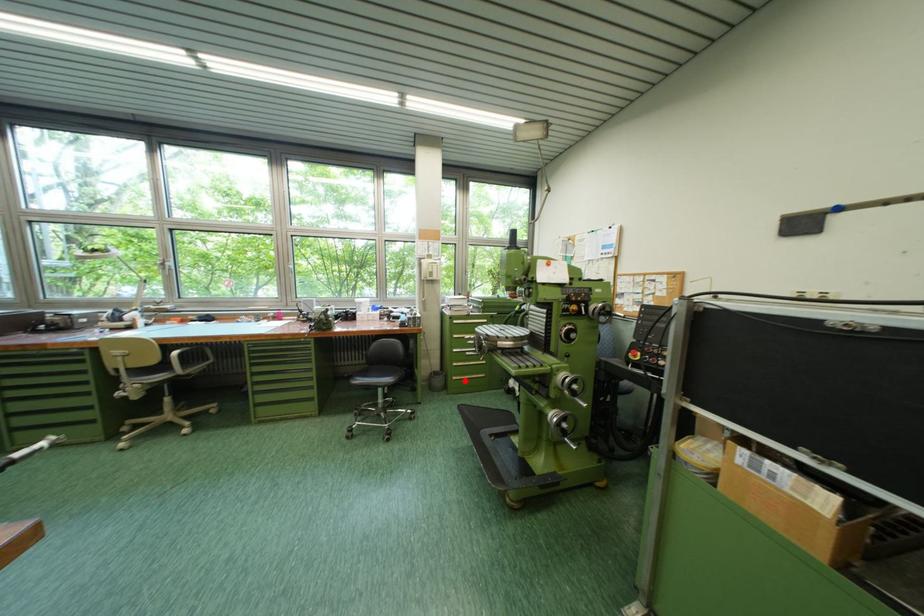
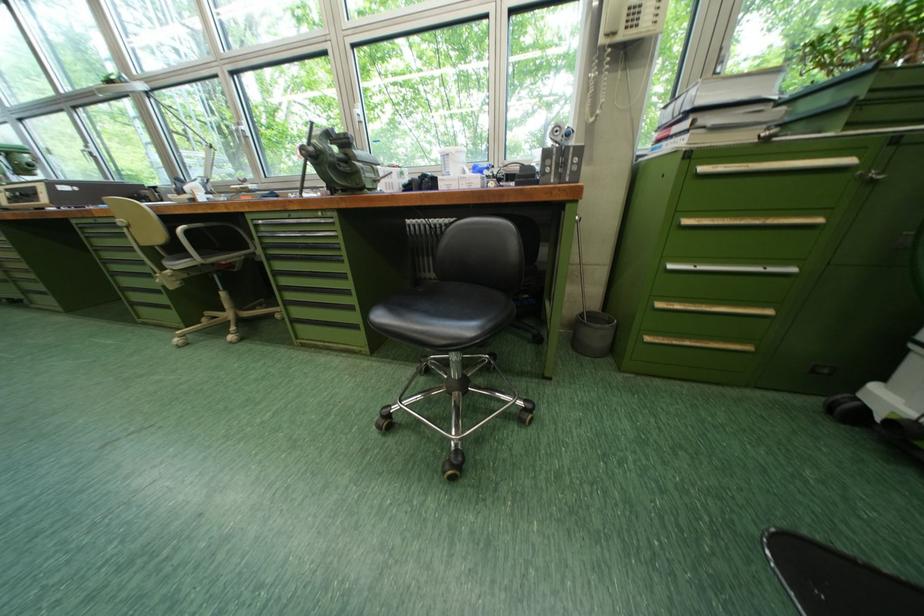
Question: I am providing you with two images of the same scene from different viewpoints. Given a red point in image1, look at the same physical point in image2. Is it:

Choices:
 (A) Closer to the viewpoint
 (B) Farther from the viewpoint

Answer: (A)